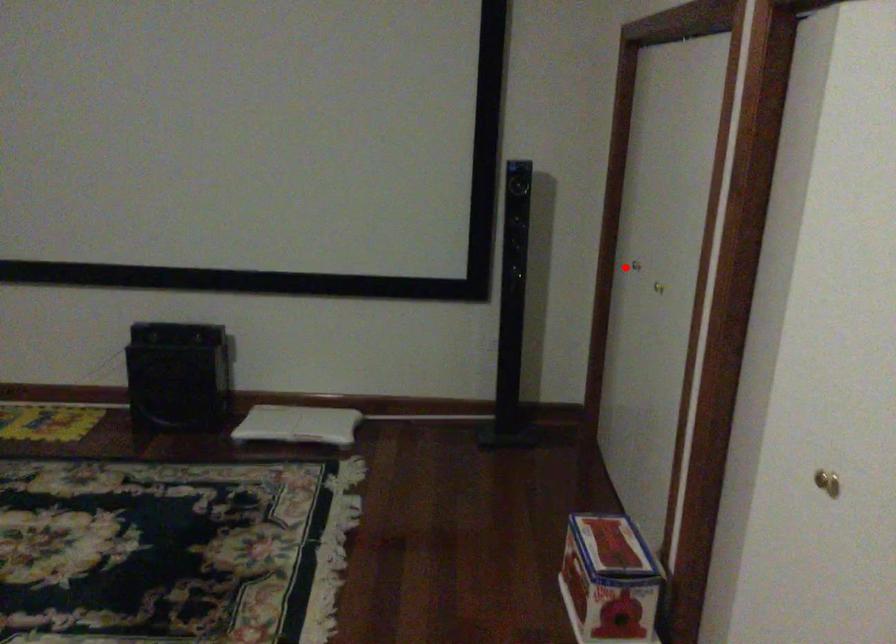
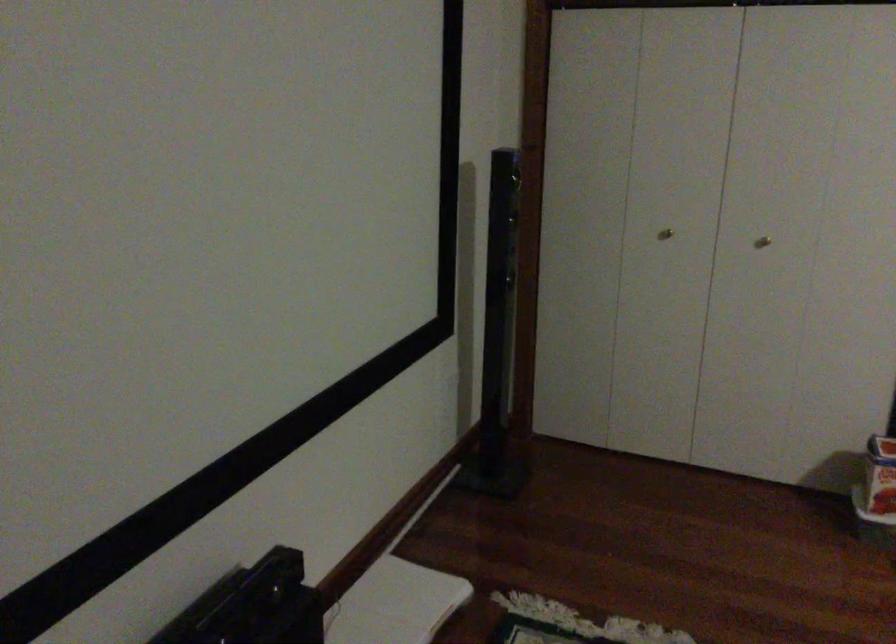
The point at the highlighted location is marked in the first image. Where is the corresponding point in the second image?

(665, 234)